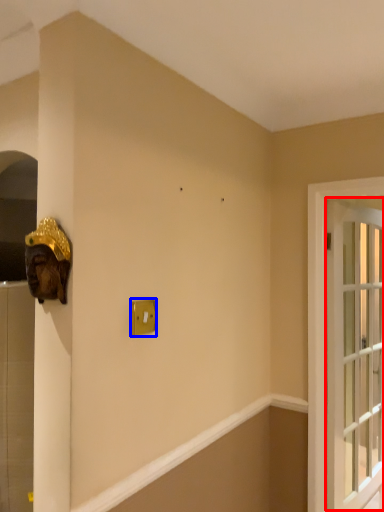
Question: Which of the following is the farthest to the observer, window (highlighted by a red box) or light switch (highlighted by a blue box)?

Choices:
 (A) window
 (B) light switch

Answer: (A)